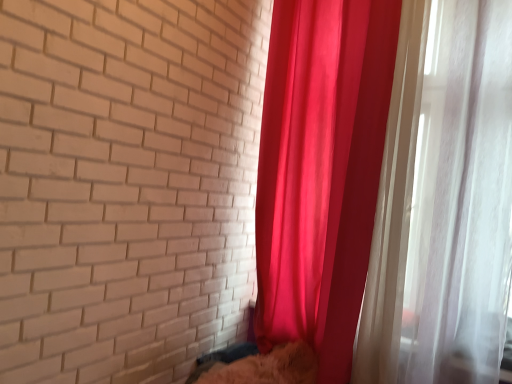
Question: Is point (275, 375) positioned closer to the camera than point (484, 137)?

Choices:
 (A) farther
 (B) closer

Answer: (A)

Question: Considering the positions of fuzzy beige cat at lower center and silky red curtain at right in the image, is fuzzy beige cat at lower center taller or shorter than silky red curtain at right?

Choices:
 (A) tall
 (B) short

Answer: (B)

Question: From a real-world perspective, is fuzzy beige cat at lower center above or below silky red curtain at right?

Choices:
 (A) below
 (B) above

Answer: (A)

Question: Considering the positions of point (474, 352) and point (222, 375), is point (474, 352) closer or farther from the camera than point (222, 375)?

Choices:
 (A) farther
 (B) closer

Answer: (B)

Question: In the image, is silky red curtain at right positioned in front of or behind fuzzy beige cat at lower center?

Choices:
 (A) behind
 (B) front

Answer: (B)

Question: Choose the correct answer: Is silky red curtain at right inside fuzzy beige cat at lower center or outside it?

Choices:
 (A) inside
 (B) outside

Answer: (B)

Question: From a real-world perspective, is silky red curtain at right above or below fuzzy beige cat at lower center?

Choices:
 (A) above
 (B) below

Answer: (A)